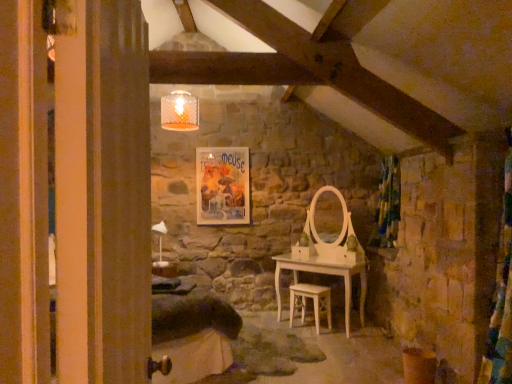
Question: Is light wood chair at center beside matte paper poster at center?

Choices:
 (A) no
 (B) yes

Answer: (A)

Question: Could you tell me if light wood chair at center is turned towards matte paper poster at center?

Choices:
 (A) yes
 (B) no

Answer: (B)

Question: Is light wood chair at center positioned beyond the bounds of matte paper poster at center?

Choices:
 (A) no
 (B) yes

Answer: (B)

Question: Is light wood chair at center further to the viewer compared to matte paper poster at center?

Choices:
 (A) no
 (B) yes

Answer: (A)

Question: From a real-world perspective, is light wood chair at center beneath matte paper poster at center?

Choices:
 (A) no
 (B) yes

Answer: (B)

Question: Looking at the image, does light wood chair at center seem bigger or smaller compared to matte paper poster at center?

Choices:
 (A) big
 (B) small

Answer: (A)

Question: Would you say light wood chair at center is to the left or to the right of matte paper poster at center in the picture?

Choices:
 (A) right
 (B) left

Answer: (A)

Question: Is light wood chair at center wider or thinner than matte paper poster at center?

Choices:
 (A) wide
 (B) thin

Answer: (A)

Question: Is light wood chair at center inside the boundaries of matte paper poster at center, or outside?

Choices:
 (A) inside
 (B) outside

Answer: (B)

Question: Does point click(x=200, y=185) appear closer or farther from the camera than point click(x=328, y=314)?

Choices:
 (A) closer
 (B) farther

Answer: (B)

Question: Is matte paper poster at center to the left or to the right of light wood chair at center in the image?

Choices:
 (A) right
 (B) left

Answer: (B)

Question: Is matte paper poster at center taller or shorter than light wood chair at center?

Choices:
 (A) short
 (B) tall

Answer: (B)

Question: Is matte paper poster at center inside the boundaries of light wood chair at center, or outside?

Choices:
 (A) outside
 (B) inside

Answer: (A)

Question: Would you say velvet green curtain at right is to the left or to the right of matte paper poster at center in the picture?

Choices:
 (A) right
 (B) left

Answer: (A)

Question: Considering the positions of velvet green curtain at right and matte paper poster at center in the image, is velvet green curtain at right bigger or smaller than matte paper poster at center?

Choices:
 (A) big
 (B) small

Answer: (A)